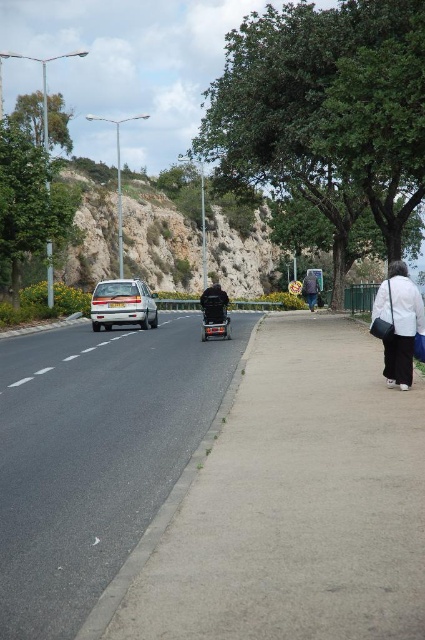
Consider the image. Can you confirm if asphalt at center is taller than white matte jacket at right?

In fact, asphalt at center may be shorter than white matte jacket at right.

Does asphalt at center have a larger size compared to white matte jacket at right?

Correct, asphalt at center is larger in size than white matte jacket at right.

Does point (125, 483) come farther from viewer compared to point (402, 356)?

No, (125, 483) is in front of (402, 356).

Image resolution: width=425 pixels, height=640 pixels. What are the coordinates of `asphalt at center` in the screenshot? It's located at pos(93,456).

The height and width of the screenshot is (640, 425). What are the coordinates of `asphalt at center` in the screenshot? It's located at (93, 456).

Is asphalt at center to the right of white cotton shirt at center from the viewer's perspective?

No, asphalt at center is not to the right of white cotton shirt at center.

I want to click on asphalt at center, so click(x=93, y=456).

Between gray asphalt sidewalk at center and white matte jacket at right, which one appears on the left side from the viewer's perspective?

From the viewer's perspective, gray asphalt sidewalk at center appears more on the left side.

Is gray asphalt sidewalk at center positioned behind white matte jacket at right?

No.

What do you see at coordinates (292, 504) in the screenshot?
I see `gray asphalt sidewalk at center` at bounding box center [292, 504].

The width and height of the screenshot is (425, 640). What are the coordinates of `gray asphalt sidewalk at center` in the screenshot? It's located at click(x=292, y=504).